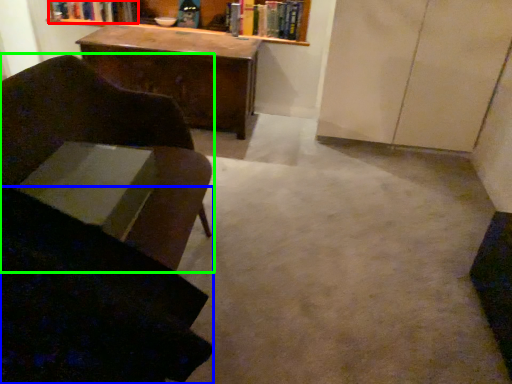
Question: Based on their relative distances, which object is nearer to book (highlighted by a red box)? Choose from swivel chair (highlighted by a blue box) and chair (highlighted by a green box).

Choices:
 (A) swivel chair
 (B) chair

Answer: (B)